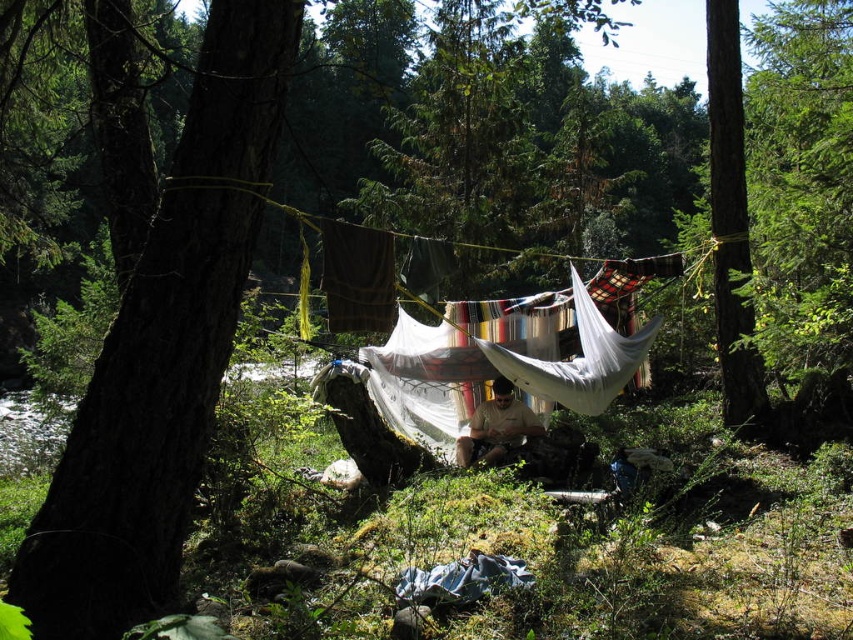
Question: Observing the image, what is the correct spatial positioning of brown rough bark tree at left in reference to green rough bark tree at right?

Choices:
 (A) right
 (B) left

Answer: (B)

Question: From the image, what is the correct spatial relationship of brown rough bark tree at left in relation to green rough bark tree at right?

Choices:
 (A) above
 (B) below

Answer: (B)

Question: Does brown rough bark tree at left lie in front of green rough bark tree at right?

Choices:
 (A) yes
 (B) no

Answer: (A)

Question: Which of the following is the farthest from the observer?

Choices:
 (A) (x=734, y=291)
 (B) (x=144, y=449)

Answer: (A)

Question: Which object is farther from the camera taking this photo?

Choices:
 (A) brown rough bark tree at left
 (B) green rough bark tree at right

Answer: (B)